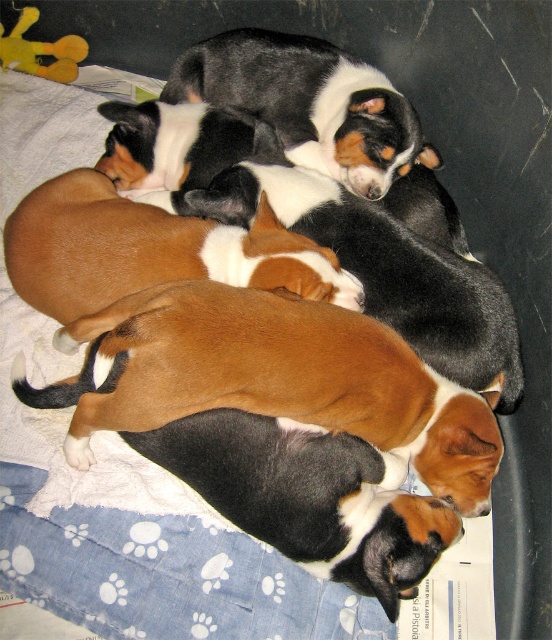
Question: Observing the image, what is the correct spatial positioning of brown and white fur at center in reference to tri-color fur sleeping puppies at center?

Choices:
 (A) left
 (B) right

Answer: (A)

Question: Among these points, which one is nearest to the camera?

Choices:
 (A) (24, 40)
 (B) (354, 339)
 (C) (198, 269)
 (D) (422, 150)

Answer: (B)

Question: Among these points, which one is nearest to the camera?

Choices:
 (A) [63, 36]
 (B) [160, 353]
 (C) [248, 74]
 (D) [146, 212]

Answer: (B)

Question: Estimate the real-world distances between objects in this image. Which object is closer to the tri-color fur sleeping puppies at center?

Choices:
 (A) yellow plush toy at upper left
 (B) brown and white fur at center

Answer: (B)

Question: Is brown fur at center further to the viewer compared to tri-color fur sleeping puppies at center?

Choices:
 (A) no
 (B) yes

Answer: (A)

Question: Observing the image, what is the correct spatial positioning of brown and white fur at center in reference to tri-color fur sleeping puppies at center?

Choices:
 (A) below
 (B) above

Answer: (A)